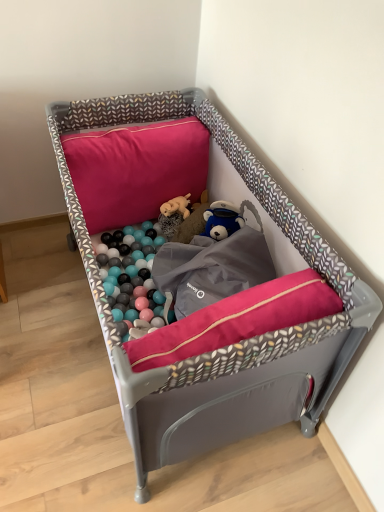
At what (x,y) coordinates should I click in order to perform the action: click on vacant space situated on the left part of matte gray playpen at center. Please return your answer as a coordinate pair (x, y). This screenshot has height=512, width=384. Looking at the image, I should click on (45, 314).